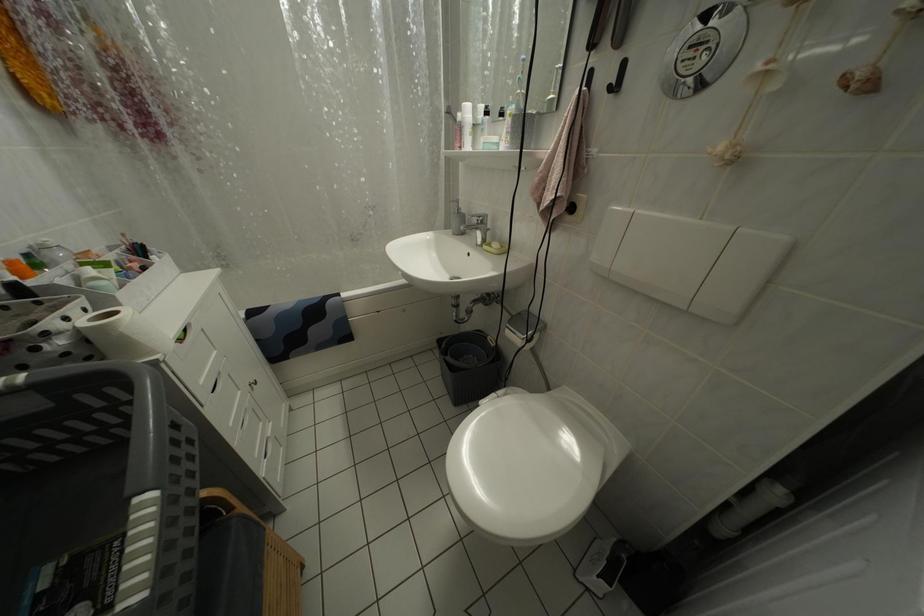
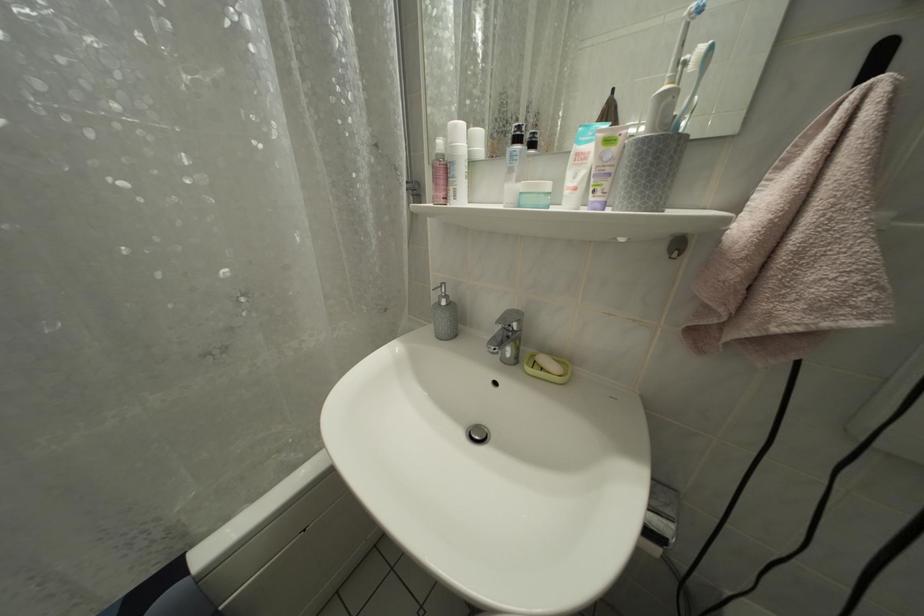
Which direction would the cameraman need to move to produce the second image?

The cameraman walked toward left, forward.